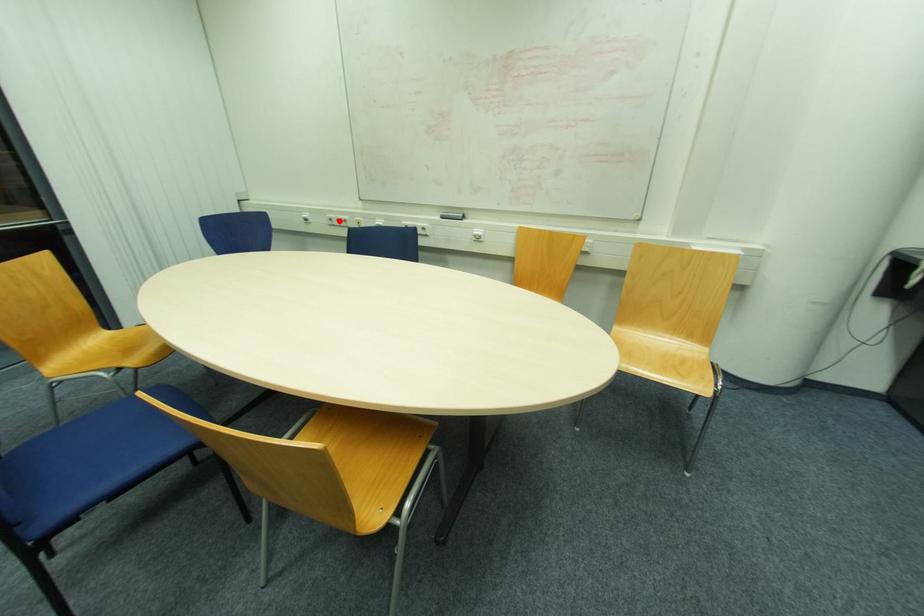
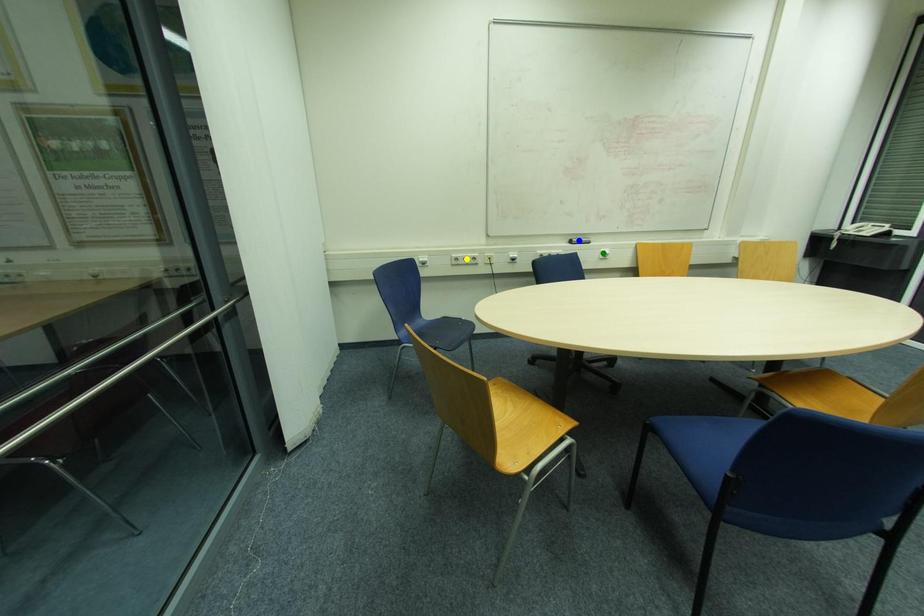
Question: I am providing you with two images of the same scene from different viewpoints. A red point is marked on the first image. You are given multiple points on the second image. Which point in image 2 is actually the same real-world point as the red point in image 1?

Choices:
 (A) green point
 (B) yellow point
 (C) blue point

Answer: (B)